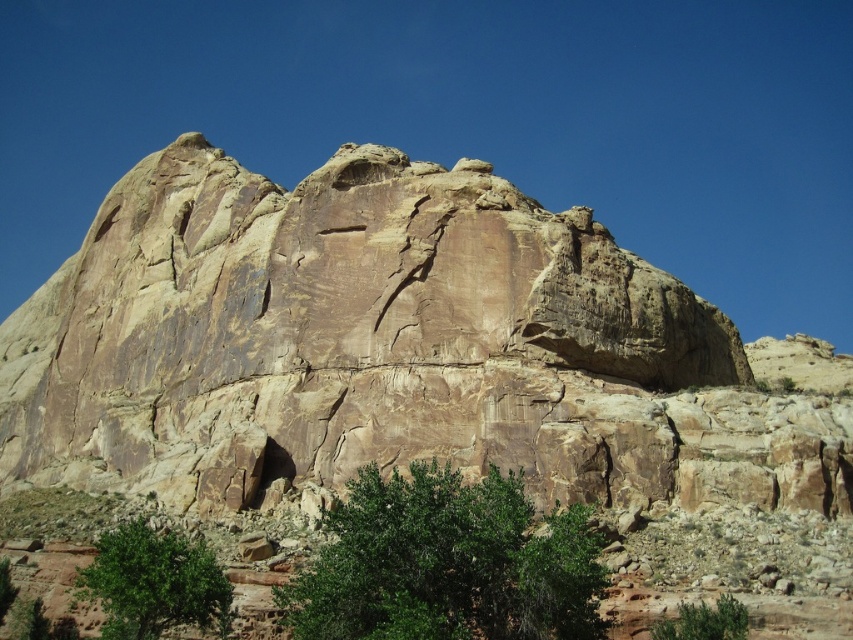
Between green leafy tree at lower left and green leafy bush at lower center, which one appears on the left side from the viewer's perspective?

From the viewer's perspective, green leafy tree at lower left appears more on the left side.

In the scene shown: Can you confirm if green leafy tree at lower left is wider than green leafy bush at lower center?

Yes, green leafy tree at lower left is wider than green leafy bush at lower center.

The width and height of the screenshot is (853, 640). Describe the element at coordinates (154, 582) in the screenshot. I see `green leafy tree at lower left` at that location.

Find the location of a particular element. This screenshot has width=853, height=640. green leafy tree at lower left is located at coordinates (154, 582).

Does green leafy tree at center come in front of green leafy bush at lower center?

Yes, it is in front of green leafy bush at lower center.

Is point (323, 602) positioned after point (668, 624)?

No.

The width and height of the screenshot is (853, 640). In order to click on green leafy tree at center in this screenshot , I will do `click(447, 563)`.

Is green leafy tree at center to the right of green leafy tree at lower left from the viewer's perspective?

Yes, green leafy tree at center is to the right of green leafy tree at lower left.

Image resolution: width=853 pixels, height=640 pixels. Describe the element at coordinates (447, 563) in the screenshot. I see `green leafy tree at center` at that location.

This screenshot has width=853, height=640. Find the location of `green leafy tree at center`. green leafy tree at center is located at coordinates (447, 563).